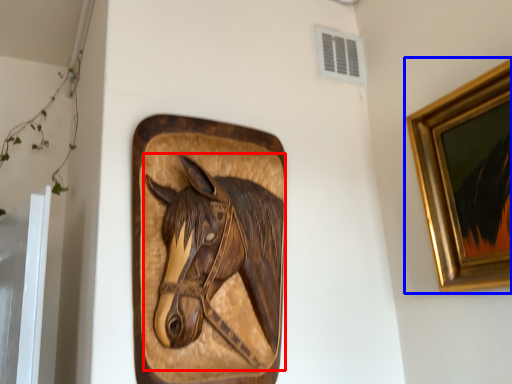
Question: Which object appears closest to the camera in this image, horse (highlighted by a red box) or picture frame (highlighted by a blue box)?

Choices:
 (A) horse
 (B) picture frame

Answer: (B)